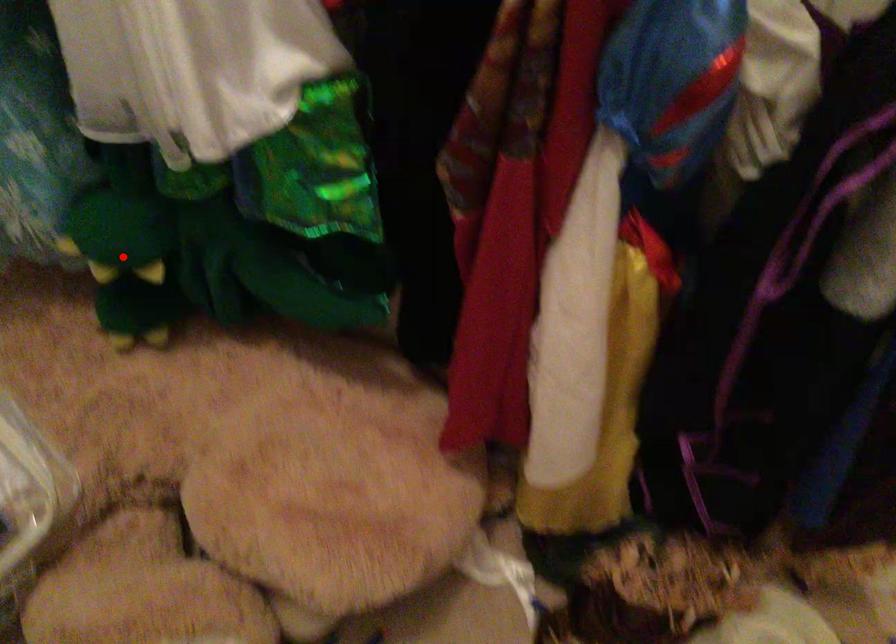
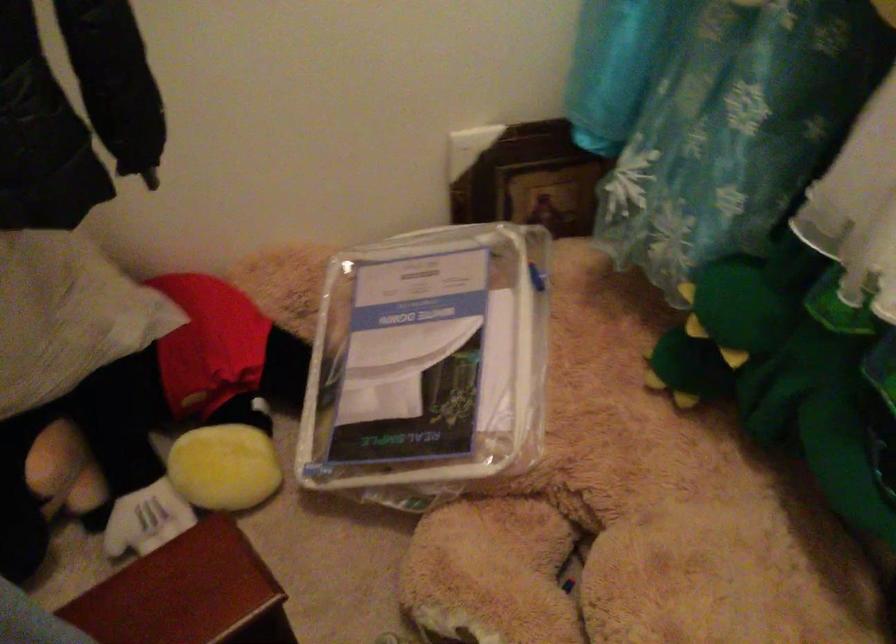
Locate, in the second image, the point that corresponds to the highlighted location in the first image.

(719, 330)